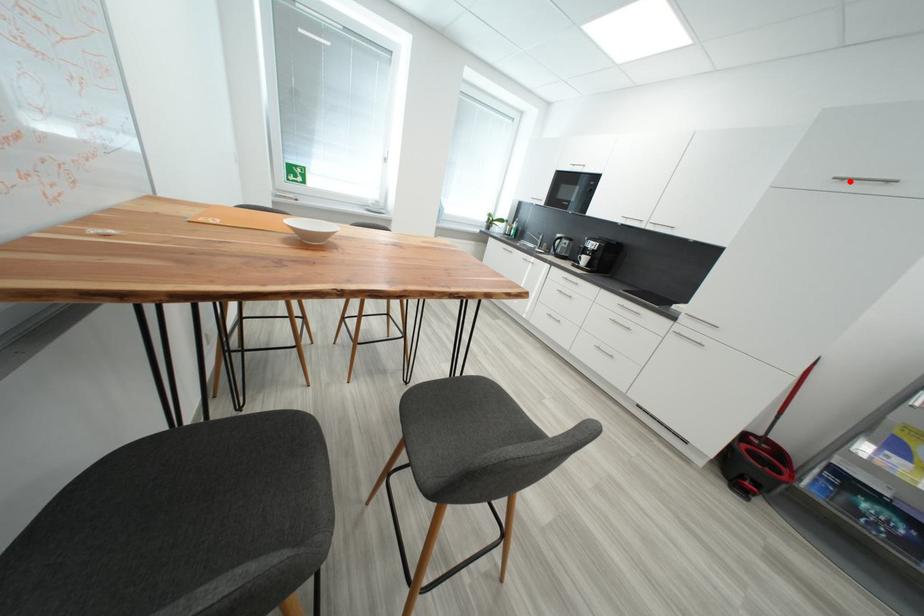
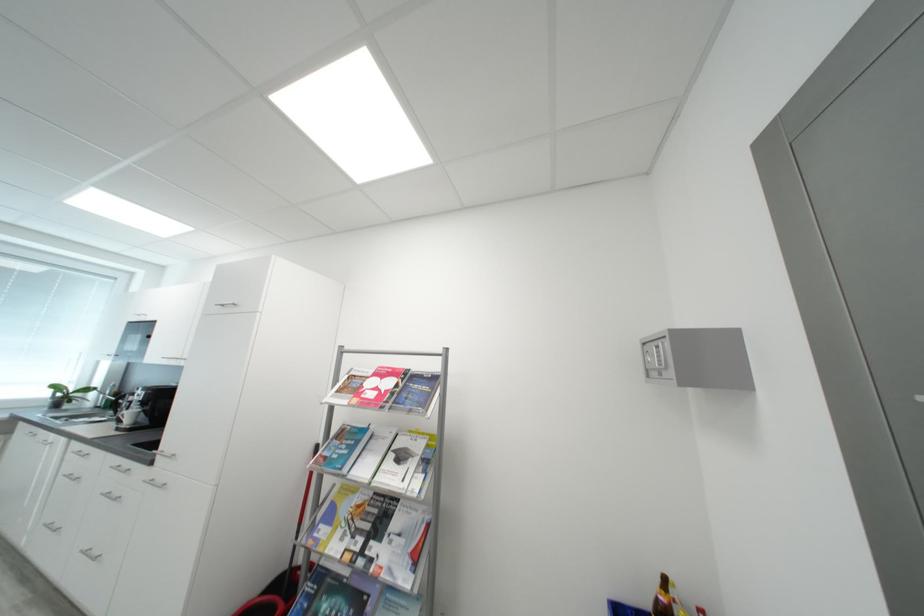
Find the pixel in the second image that matches the highlighted location in the first image.

(228, 307)